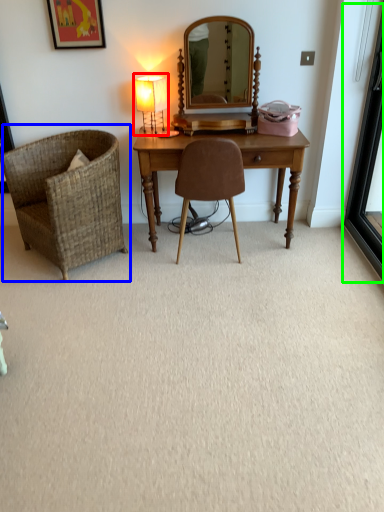
Question: Which object is the farthest from table lamp (highlighted by a red box)? Choose among these: chair (highlighted by a blue box) or screen door (highlighted by a green box).

Choices:
 (A) chair
 (B) screen door

Answer: (B)